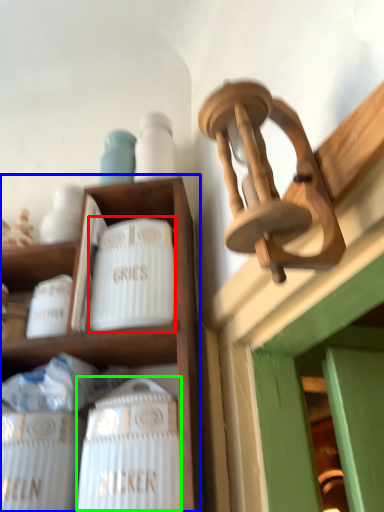
Question: Which object is the closest to the pottery (highlighted by a red box)? Choose among these: shelf (highlighted by a blue box) or wine bottle (highlighted by a green box).

Choices:
 (A) shelf
 (B) wine bottle

Answer: (A)